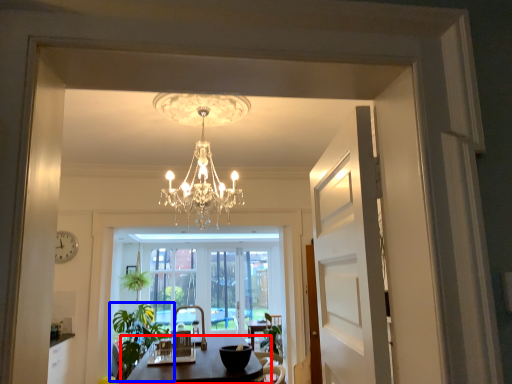
Question: Which object is closer to the camera taking this photo, table (highlighted by a red box) or houseplant (highlighted by a blue box)?

Choices:
 (A) table
 (B) houseplant

Answer: (A)